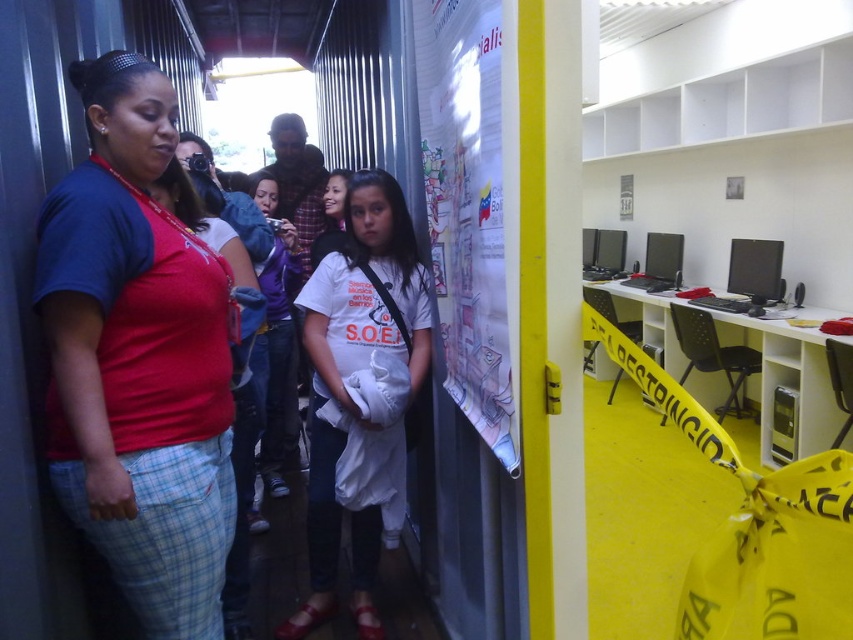
Based on the photo, you are organizing a clothing donation drive and need to arrange items by height. You have a red cotton shirt at left and a purple fleece jacket at center. Which item should be placed first if you are arranging them from top to bottom based on their positions?

The red cotton shirt at left should be placed first since it is above the purple fleece jacket at center, making it the higher item in the arrangement.